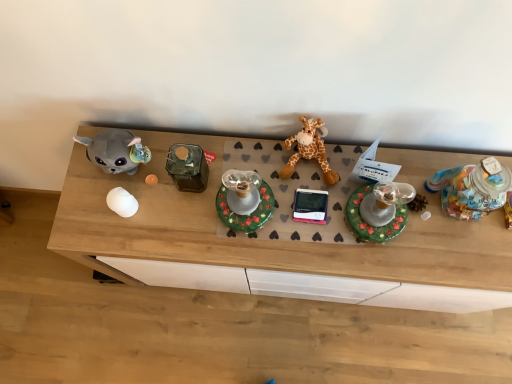
You are a GUI agent. You are given a task and a screenshot of the screen. Output one action in this format:
    pyautogui.click(x=<x>, y=<y>)
    Task: Click on the unoccupied area behind white glossy egg at center, which is the first toy from left to right
    The height and width of the screenshot is (384, 512).
    Given the screenshot: What is the action you would take?
    (138, 168)